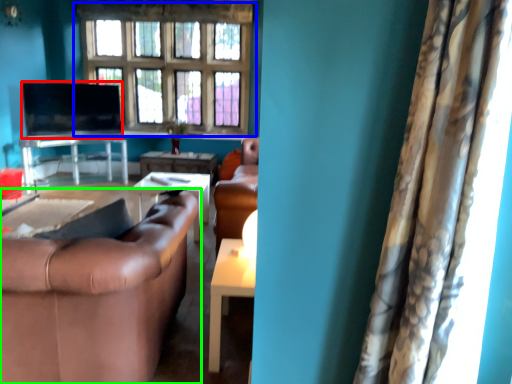
Question: Which is nearer to the flat (highlighted by a red box)? window (highlighted by a blue box) or studio couch (highlighted by a green box).

Choices:
 (A) window
 (B) studio couch

Answer: (A)